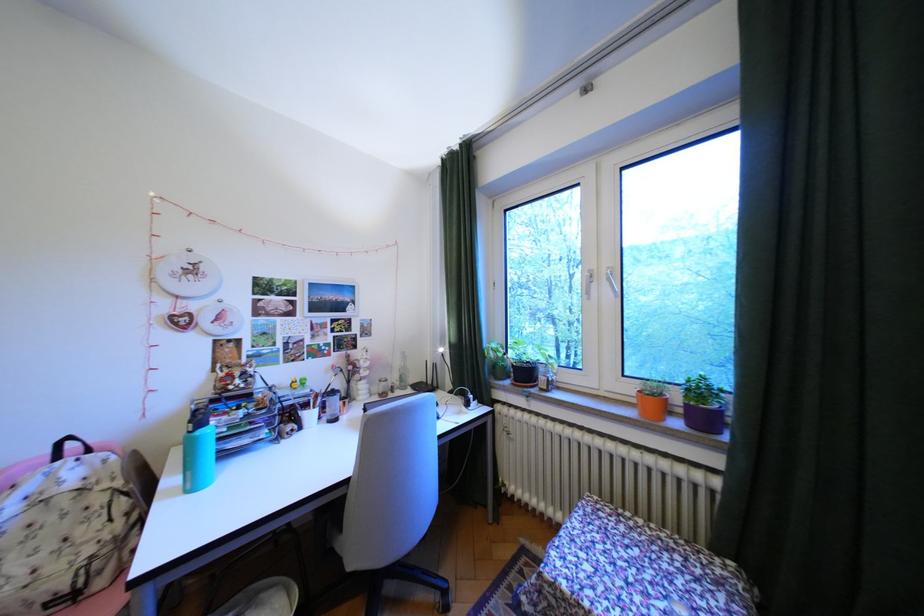
Which object does [702,405] point to?

It corresponds to the purple flower pot in the image.